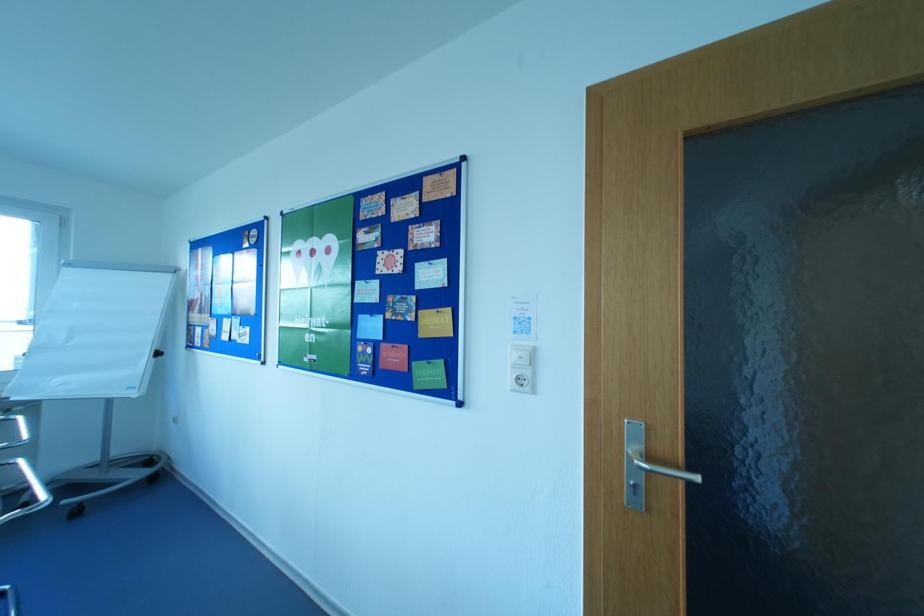
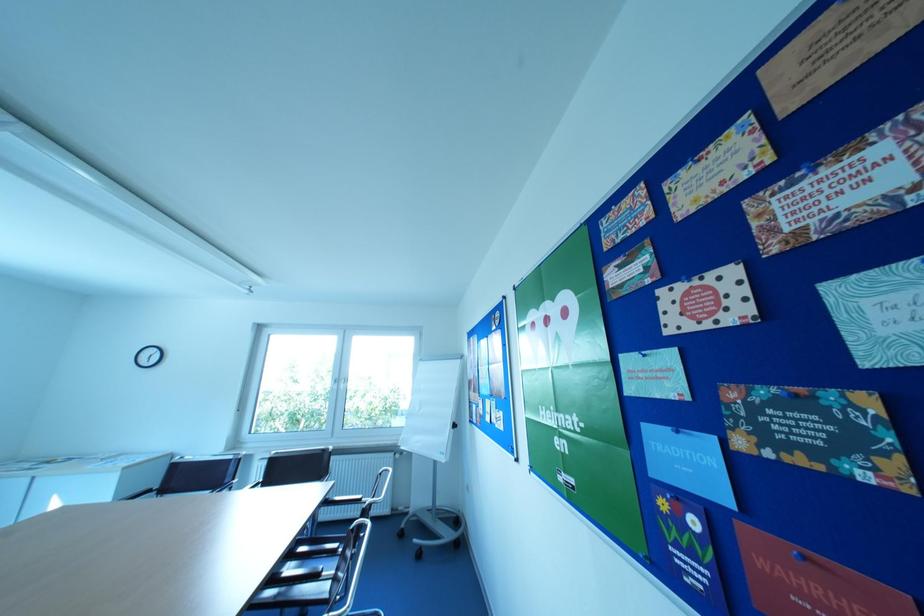
First-person continuous shooting, in which direction is the camera rotating?

The camera rotated toward left-up.